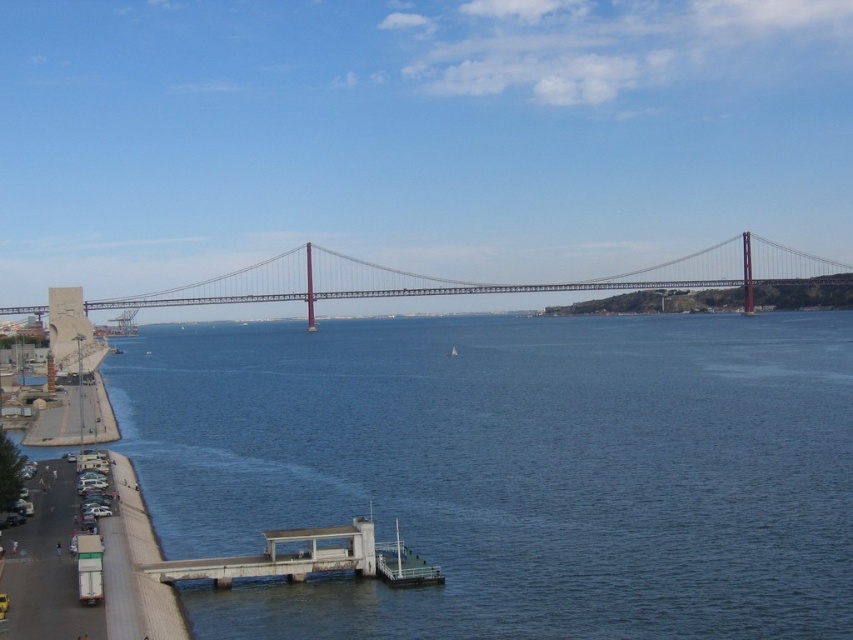
Consider the image. Can you confirm if blue water at center is wider than metallic gray suspension bridge at center?

No, blue water at center is not wider than metallic gray suspension bridge at center.

Between point (839, 368) and point (315, 284), which one is positioned behind?

The point (315, 284) is more distant.

Who is more forward, (802, 516) or (180, 300)?

Positioned in front is point (802, 516).

Find the location of `blue water at center`. blue water at center is located at coordinates (509, 470).